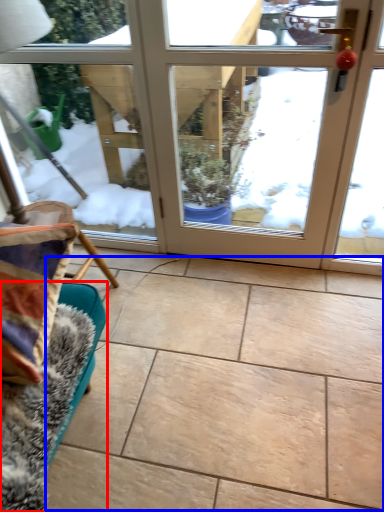
Question: Which object is closer to the camera taking this photo, furniture (highlighted by a red box) or ceramic tile (highlighted by a blue box)?

Choices:
 (A) furniture
 (B) ceramic tile

Answer: (A)